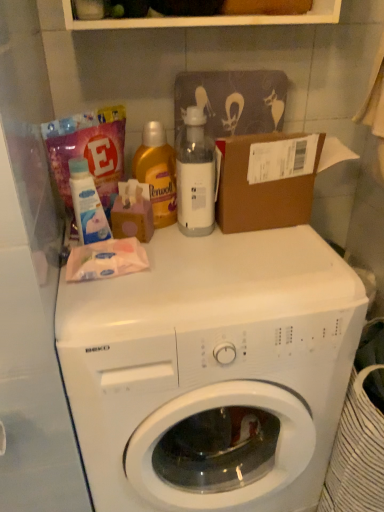
Locate an element on the screen. This screenshot has width=384, height=512. empty space that is ontop of white glossy washing machine at center (from a real-world perspective) is located at coordinates (211, 261).